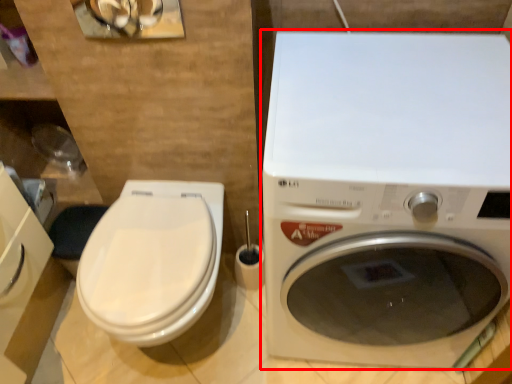
Question: From the image's perspective, what is the correct spatial positioning of washing machine (annotated by the red box) in reference to toilet?

Choices:
 (A) above
 (B) below

Answer: (A)